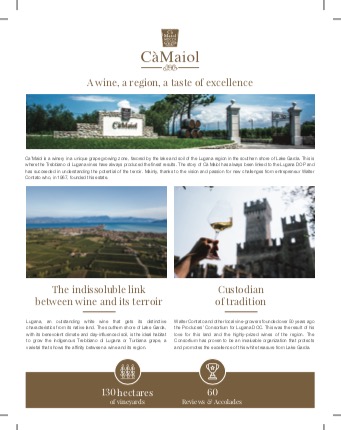
At what (x,y) coordinates should I click in order to perform the action: click on trophy. Please return your answer as a coordinate pair (x, y). Looking at the image, I should click on (208, 381).